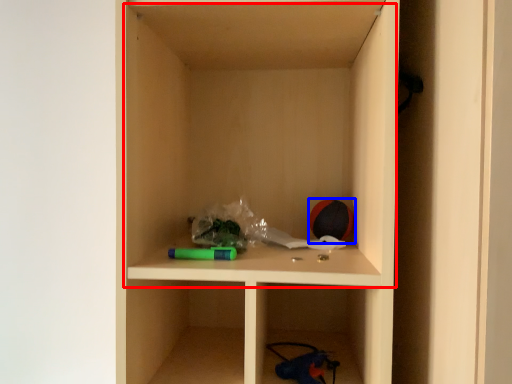
Question: Which of the following is the farthest to the observer, cabinet (highlighted by a red box) or toy (highlighted by a blue box)?

Choices:
 (A) cabinet
 (B) toy

Answer: (B)